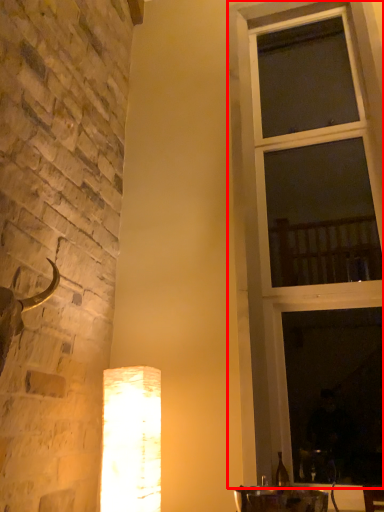
Question: Where is window (annotated by the red box) located in relation to lamp in the image?

Choices:
 (A) right
 (B) left

Answer: (A)